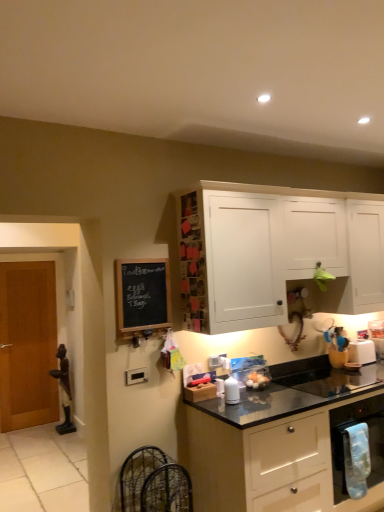
The width and height of the screenshot is (384, 512). Identify the location of black matte countertop at lower right, the 2th cabinetry positioned from the top. (286, 445).

Identify the location of white plastic toaster at right, which is the 2th appliance in front-to-back order. (361, 351).

Looking at this image, what is the approximate width of white plastic toaster at right, which appears as the 1th appliance when viewed from the back?

white plastic toaster at right, which appears as the 1th appliance when viewed from the back, is 6.70 inches in width.

The height and width of the screenshot is (512, 384). In order to click on wooden door at left in this screenshot , I will do `click(28, 345)`.

From the image's perspective, would you say wooden door at left is shown under black granite sink at lower right?

Yes, from the image's perspective, wooden door at left is below black granite sink at lower right.

Is wooden door at left in front of or behind black granite sink at lower right in the image?

wooden door at left is positioned farther from the viewer than black granite sink at lower right.

This screenshot has height=512, width=384. Identify the location of sink that appears in front of the wooden door at left. (334, 380).

Which is more to the left, wooden door at left or black granite sink at lower right?

wooden door at left is more to the left.

Considering the relative positions of white glossy salt shaker at center, the 2th appliance in the back-to-front sequence, and white plastic toaster at right, which is the 2th appliance in front-to-back order, in the image provided, is white glossy salt shaker at center, the 2th appliance in the back-to-front sequence, to the left of white plastic toaster at right, which is the 2th appliance in front-to-back order, from the viewer's perspective?

Correct, you'll find white glossy salt shaker at center, the 2th appliance in the back-to-front sequence, to the left of white plastic toaster at right, which is the 2th appliance in front-to-back order.

What's the angular difference between white glossy salt shaker at center, which is the 2th appliance from right to left, and white plastic toaster at right, which appears as the 1th appliance when viewed from the back,'s facing directions?

0.231 degrees.

From a real-world perspective, is white glossy salt shaker at center, which is the 2th appliance from right to left, located beneath white plastic toaster at right, acting as the 1th appliance starting from the right?

Yes.

Is white glossy salt shaker at center, acting as the 1th appliance starting from the front, far away from white plastic toaster at right, which appears as the 2th appliance when viewed from the left?

That's right, there is a large distance between white glossy salt shaker at center, acting as the 1th appliance starting from the front, and white plastic toaster at right, which appears as the 2th appliance when viewed from the left.

Find the location of a particular element. This screenshot has width=384, height=512. cabinetry located below the black granite sink at lower right (from the image's perspective) is located at coordinates (286, 445).

Considering the relative sizes of black matte countertop at lower right, the 2th cabinetry positioned from the top, and black granite sink at lower right in the image provided, is black matte countertop at lower right, the 2th cabinetry positioned from the top, shorter than black granite sink at lower right?

No, black matte countertop at lower right, the 2th cabinetry positioned from the top, is not shorter than black granite sink at lower right.

Is black matte countertop at lower right, positioned as the 1th cabinetry in bottom-to-top order, wider or thinner than black granite sink at lower right?

Clearly, black matte countertop at lower right, positioned as the 1th cabinetry in bottom-to-top order, has more width compared to black granite sink at lower right.

Considering the positions of point (315, 434) and point (309, 376), is point (315, 434) closer or farther from the camera than point (309, 376)?

Clearly, point (315, 434) is closer to the camera than point (309, 376).

From their relative heights in the image, would you say white plastic toaster at right, which appears as the 2th appliance when viewed from the left, is taller or shorter than black chalkboard at left?

Considering their sizes, white plastic toaster at right, which appears as the 2th appliance when viewed from the left, has less height than black chalkboard at left.

Which object is positioned more to the left, white plastic toaster at right, which appears as the 2th appliance when viewed from the left, or black chalkboard at left?

Positioned to the left is black chalkboard at left.

Is white plastic toaster at right, which appears as the 1th appliance when viewed from the back, behind black chalkboard at left?

Yes, it is.

Is black granite sink at lower right to the left or to the right of black chalkboard at left in the image?

From the image, it's evident that black granite sink at lower right is to the right of black chalkboard at left.

In terms of size, does black granite sink at lower right appear bigger or smaller than black chalkboard at left?

black granite sink at lower right is bigger than black chalkboard at left.

The width and height of the screenshot is (384, 512). I want to click on sink lying below the black chalkboard at left (from the image's perspective), so click(334, 380).

Consider the image. Is blue fabric towel at lower right not within wooden door at left?

Yes, blue fabric towel at lower right is not within wooden door at left.

Where is `door behind the blue fabric towel at lower right`? door behind the blue fabric towel at lower right is located at coordinates (28, 345).

Is blue fabric towel at lower right touching wooden door at left?

No.

How many degrees apart are the facing directions of blue fabric towel at lower right and wooden door at left?

The angular difference between blue fabric towel at lower right and wooden door at left is 1.59 degrees.

Between point (377, 435) and point (320, 386), which one is positioned behind?

The point (320, 386) is farther from the camera.

Is blue fabric towel at lower right situated inside black granite sink at lower right or outside?

blue fabric towel at lower right is not enclosed by black granite sink at lower right.

From a real-world perspective, who is located lower, blue fabric towel at lower right or black granite sink at lower right?

From a 3D spatial view, blue fabric towel at lower right is below.

Which of these two, blue fabric towel at lower right or black granite sink at lower right, stands taller?

blue fabric towel at lower right is taller.

Image resolution: width=384 pixels, height=512 pixels. I want to click on sink above the wooden door at left (from the image's perspective), so click(x=334, y=380).

Where is `appliance on the left of white plastic toaster at right, which appears as the 2th appliance when viewed from the left`? The height and width of the screenshot is (512, 384). appliance on the left of white plastic toaster at right, which appears as the 2th appliance when viewed from the left is located at coordinates (231, 391).

Consider the image. From the image, which object appears to be farther from black granite sink at lower right, black matte countertop at lower right, positioned as the 1th cabinetry in bottom-to-top order, or blue fabric towel at lower right?

Based on the image, black matte countertop at lower right, positioned as the 1th cabinetry in bottom-to-top order, appears to be further to black granite sink at lower right.

Looking at the image, which one is located further to white matte cabinet at upper center, which is the first cabinetry in top-to-bottom order, blue fabric towel at lower right or black chalkboard at left?

blue fabric towel at lower right.

From the image, which object appears to be nearer to black matte countertop at lower right, the 2th cabinetry positioned from the top, black chalkboard at left or blue fabric towel at lower right?

blue fabric towel at lower right.

Looking at the image, which one is located closer to black granite sink at lower right, wooden door at left or blue fabric towel at lower right?

Among the two, blue fabric towel at lower right is located nearer to black granite sink at lower right.

Which object lies nearer to the anchor point wooden door at left, white glossy salt shaker at center, which appears as the 1th appliance when viewed from the left, or black matte countertop at lower right, positioned as the 1th cabinetry in bottom-to-top order?

Based on the image, black matte countertop at lower right, positioned as the 1th cabinetry in bottom-to-top order, appears to be nearer to wooden door at left.

Which object lies nearer to the anchor point black matte countertop at lower right, the 2th cabinetry positioned from the top, wooden door at left or white plastic toaster at right, acting as the 1th appliance starting from the right?

white plastic toaster at right, acting as the 1th appliance starting from the right, is closer to black matte countertop at lower right, the 2th cabinetry positioned from the top.

Estimate the real-world distances between objects in this image. Which object is closer to black chalkboard at left, white glossy salt shaker at center, which is the 2th appliance from right to left, or black granite sink at lower right?

Among the two, white glossy salt shaker at center, which is the 2th appliance from right to left, is located nearer to black chalkboard at left.

When comparing their distances from black granite sink at lower right, does wooden door at left or black matte countertop at lower right, the 2th cabinetry positioned from the top, seem further?

Among the two, wooden door at left is located further to black granite sink at lower right.

In order to click on sink located between blue fabric towel at lower right and white plastic toaster at right, which appears as the 2th appliance when viewed from the left, in the depth direction in this screenshot , I will do `click(334, 380)`.

The width and height of the screenshot is (384, 512). Identify the location of kitchen appliance situated between white glossy salt shaker at center, which is the 2th appliance from right to left, and white plastic toaster at right, which is the 2th appliance in front-to-back order, from left to right. (348, 440).

Where is `kitchen appliance between wooden door at left and white plastic toaster at right, which appears as the 1th appliance when viewed from the back, in the horizontal direction`? Image resolution: width=384 pixels, height=512 pixels. kitchen appliance between wooden door at left and white plastic toaster at right, which appears as the 1th appliance when viewed from the back, in the horizontal direction is located at coordinates (348, 440).

At what (x,y) coordinates should I click in order to perform the action: click on sink located between white matte cabinet at upper center, which is the 2th cabinetry in bottom-to-top order, and white plastic toaster at right, acting as the 1th appliance starting from the right, in the depth direction. Please return your answer as a coordinate pair (x, y). Looking at the image, I should click on (334, 380).